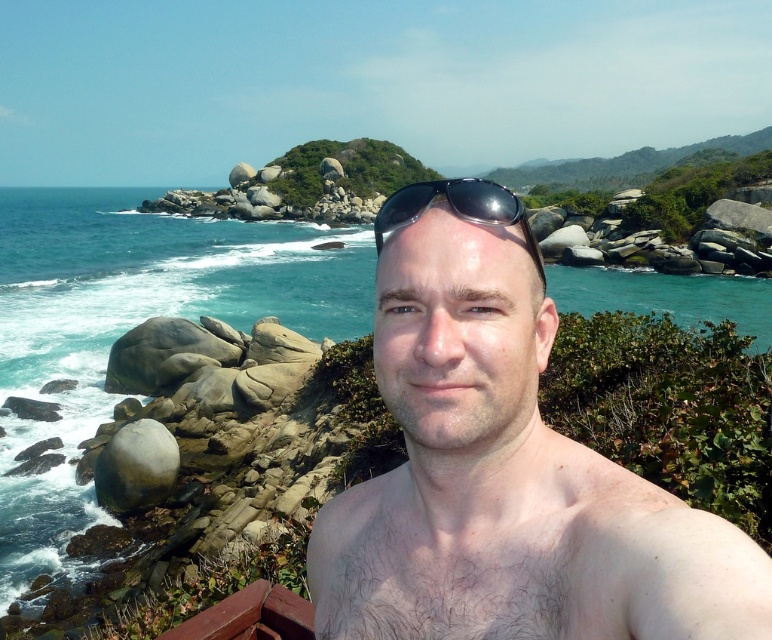
Question: Which point is farther to the camera?

Choices:
 (A) smooth skin man at center
 (B) black shiny sunglasses at center

Answer: (B)

Question: Among these points, which one is nearest to the camera?

Choices:
 (A) (454, 204)
 (B) (725, 534)

Answer: (B)

Question: Is smooth skin man at center bigger than black shiny sunglasses at center?

Choices:
 (A) no
 (B) yes

Answer: (A)

Question: Is smooth skin man at center above black shiny sunglasses at center?

Choices:
 (A) no
 (B) yes

Answer: (A)

Question: From the image, what is the correct spatial relationship of smooth skin man at center in relation to black shiny sunglasses at center?

Choices:
 (A) right
 (B) left

Answer: (A)